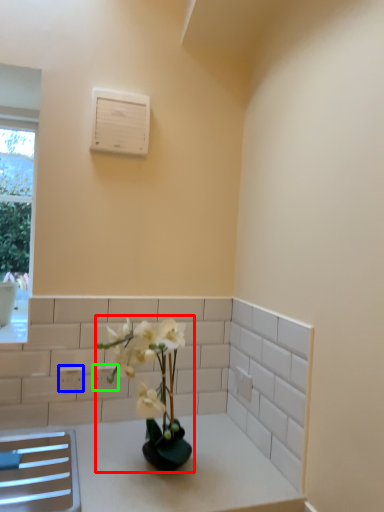
Question: Which object is the closest to the houseplant (highlighted by a red box)? Choose among these: electric outlet (highlighted by a blue box) or electric outlet (highlighted by a green box).

Choices:
 (A) electric outlet
 (B) electric outlet

Answer: (B)